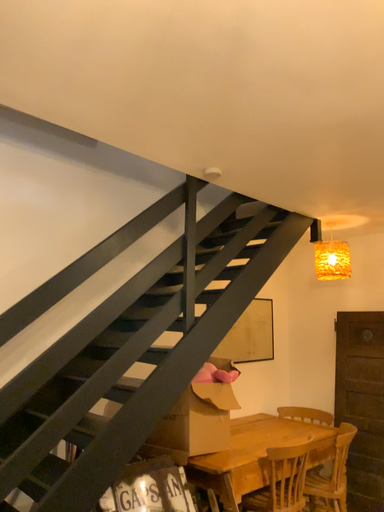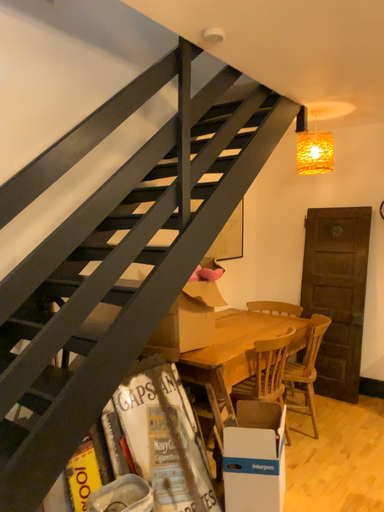
Question: Which way did the camera rotate in the video?

Choices:
 (A) rotated right
 (B) rotated left

Answer: (A)